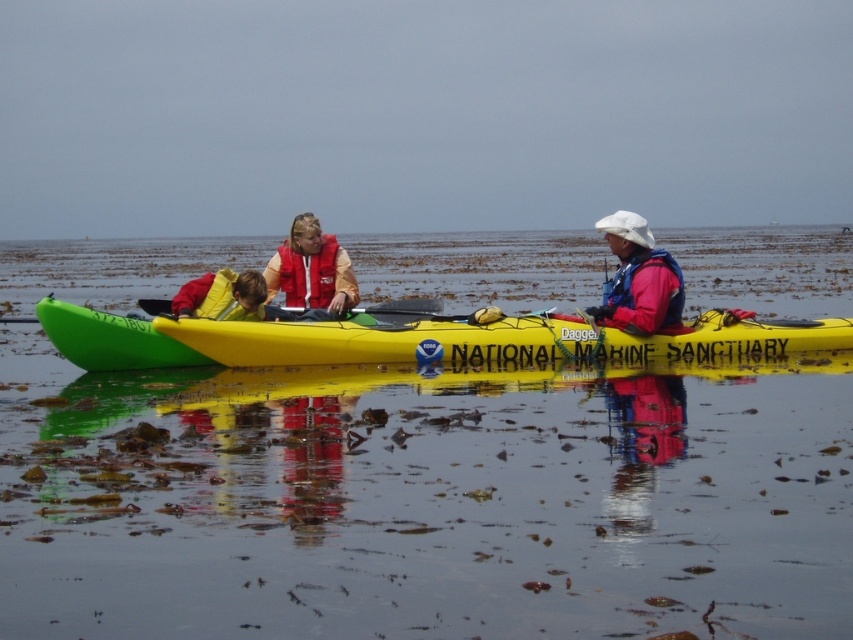
Between green plastic kayak at center and yellow life vest at left, which one has more height?

With more height is yellow life vest at left.

Does green plastic kayak at center appear on the left side of yellow life vest at left?

In fact, green plastic kayak at center is to the right of yellow life vest at left.

Find the location of `green plastic kayak at center`. green plastic kayak at center is located at coordinates (412, 339).

The image size is (853, 640). I want to click on green plastic kayak at center, so tap(412, 339).

Can you confirm if red life vest at center is shorter than matte red life jacket at center?

No, red life vest at center is not shorter than matte red life jacket at center.

Between red life vest at center and matte red life jacket at center, which one appears on the right side from the viewer's perspective?

matte red life jacket at center is more to the right.

Does point (271, 262) come in front of point (297, 253)?

That is False.

The height and width of the screenshot is (640, 853). I want to click on red life vest at center, so click(311, 268).

Which is in front, point (374, 353) or point (303, 296)?

Point (374, 353) is in front.

Which of these two, green plastic kayak at center or matte red life jacket at center, stands taller?

matte red life jacket at center is taller.

Who is more distant from viewer, (746, 326) or (318, 291)?

Positioned behind is point (318, 291).

At what (x,y) coordinates should I click in order to perform the action: click on green plastic kayak at center. Please return your answer as a coordinate pair (x, y). This screenshot has width=853, height=640. Looking at the image, I should click on (412, 339).